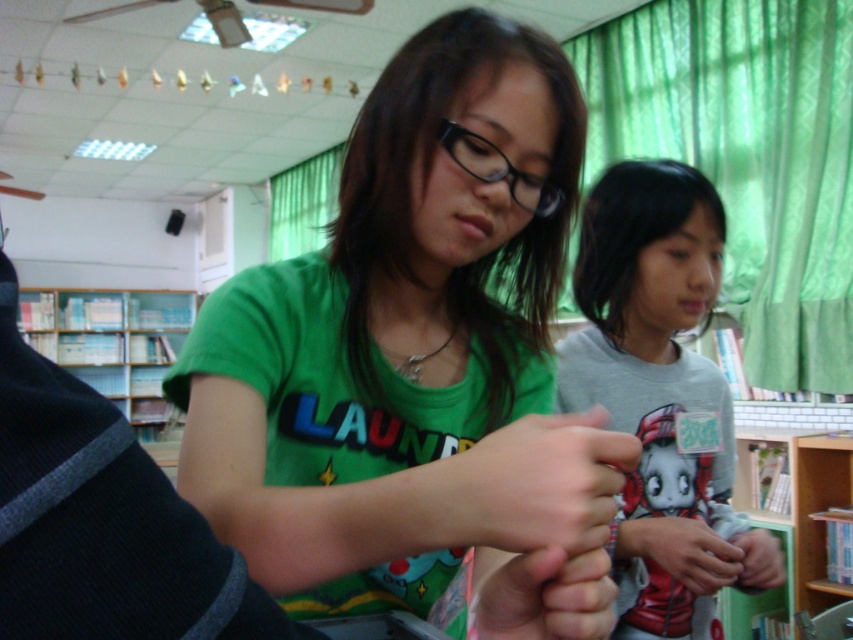
Does matte green shirt at center have a greater height compared to smooth skin hand at center?

In fact, matte green shirt at center may be shorter than smooth skin hand at center.

This screenshot has width=853, height=640. I want to click on matte green shirt at center, so click(540, 483).

Is point (463, 536) behind point (581, 614)?

Yes, point (463, 536) is behind point (581, 614).

This screenshot has width=853, height=640. What are the coordinates of `matte green shirt at center` in the screenshot? It's located at (540, 483).

Which is behind, point (18, 308) or point (724, 582)?

Positioned behind is point (18, 308).

Does point (57, 330) lie in front of point (677, 522)?

No, (57, 330) is further to viewer.

Does point (22, 324) lie in front of point (741, 548)?

No, it is not.

Identify the location of wooden bookshelf at left. (112, 342).

Can you confirm if matte green shirt at center is positioned to the right of matte black hand at center?

No, matte green shirt at center is not to the right of matte black hand at center.

Which is behind, point (587, 417) or point (703, 547)?

Positioned behind is point (703, 547).

Image resolution: width=853 pixels, height=640 pixels. I want to click on matte green shirt at center, so click(540, 483).